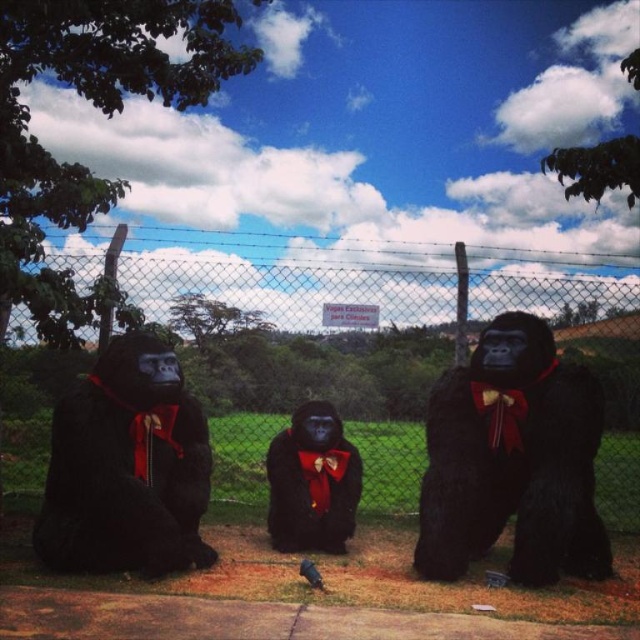
Between black matte gorilla at right and matte black gorilla at left, which one is positioned lower?

black matte gorilla at right

Is black matte gorilla at right smaller than matte black gorilla at left?

Actually, black matte gorilla at right might be larger than matte black gorilla at left.

Where is `black matte gorilla at right`? The image size is (640, 640). black matte gorilla at right is located at coordinates (513, 460).

Who is taller, wire mesh fence at center or velvet black gorilla at center?

wire mesh fence at center

Is wire mesh fence at center closer to the viewer compared to velvet black gorilla at center?

No.

Find the location of `wire mesh fence at center`. wire mesh fence at center is located at coordinates (304, 358).

Can you confirm if wire mesh fence at center is thinner than black matte gorilla at right?

No.

You are a GUI agent. You are given a task and a screenshot of the screen. Output one action in this format:
    pyautogui.click(x=<x>, y=<y>)
    Task: Click on the wire mesh fence at center
    
    Given the screenshot: What is the action you would take?
    pyautogui.click(x=304, y=358)